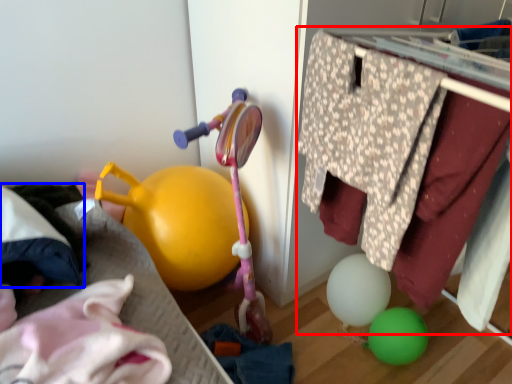
Question: Which object appears farthest to the camera in this image, closet (highlighted by a red box) or clothing (highlighted by a blue box)?

Choices:
 (A) closet
 (B) clothing

Answer: (B)